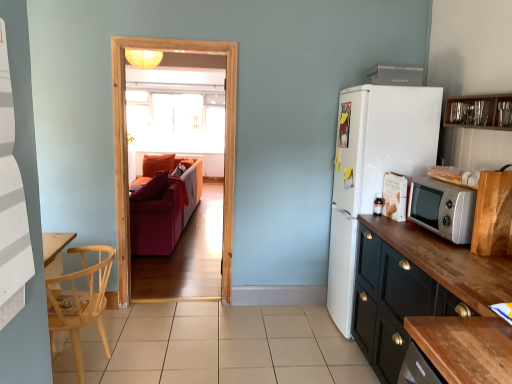
Image resolution: width=512 pixels, height=384 pixels. What are the coordinates of `free space on the front side of silver metallic microwave oven at right` in the screenshot? It's located at (463, 257).